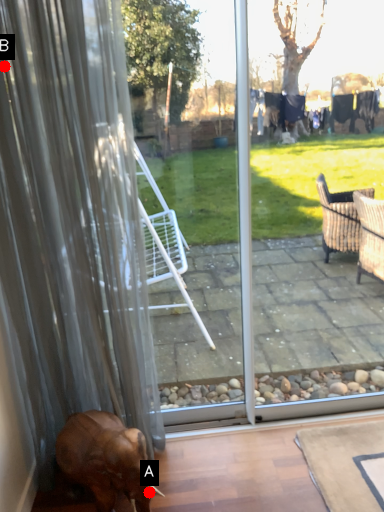
Question: Two points are circled on the image, labeled by A and B beside each circle. Which of the following is the farthest from the observer?

Choices:
 (A) A is further
 (B) B is further

Answer: (A)